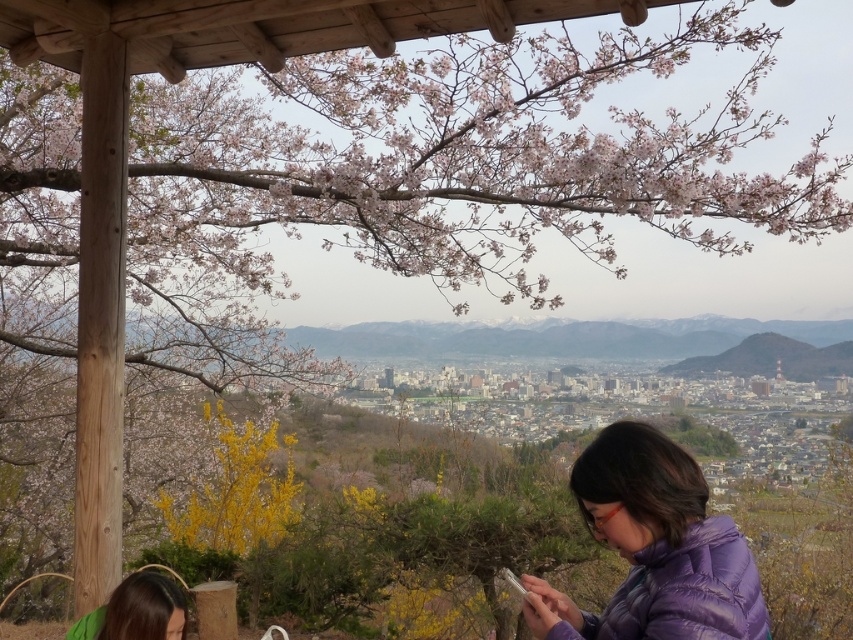
You are a photographer trying to capture a portrait of the person in the scene. You notice the purple down jacket at lower right and the green fabric hair at lower left. Which object should you adjust your camera angle to avoid blocking the person?

The purple down jacket at lower right is much taller than the green fabric hair at lower left, so adjusting the camera angle to avoid the purple down jacket at lower right would prevent it from blocking the person.

You are a photographer trying to capture the city view from the wooden structure. You notice the purple down jacket at lower right and the green fabric hair at lower left in your frame. Which object should you adjust your camera to focus on if you want to prioritize the larger object in the scene?

The purple down jacket at lower right has a larger size compared to the green fabric hair at lower left, so you should focus on the purple down jacket at lower right to prioritize the larger object in the scene.

You are a photographer trying to capture the city view from the wooden structure. There are two items in your way. The purple down jacket at lower right and the green fabric hair at lower left. Which item is blocking your view more?

The purple down jacket at lower right is positioned over green fabric hair at lower left, so it is blocking the view more.